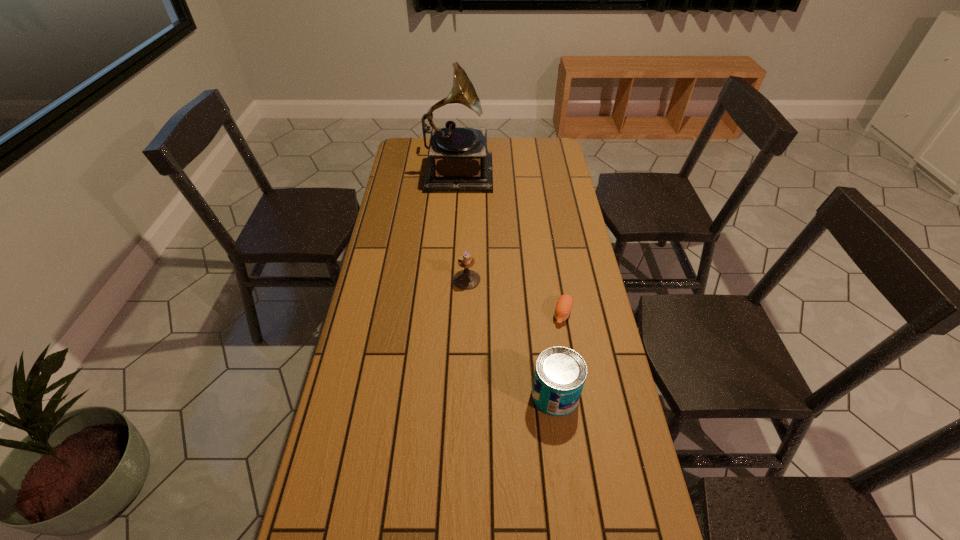
In order to click on free space between the sushi and the second farthest object in this screenshot , I will do `click(515, 296)`.

Where is `free space that is in between the tallest object and the third nearest object`? free space that is in between the tallest object and the third nearest object is located at coordinates (462, 225).

The width and height of the screenshot is (960, 540). I want to click on vacant area between the second farthest object and the shortest object, so click(x=515, y=296).

The height and width of the screenshot is (540, 960). Find the location of `empty space that is in between the can and the third nearest object`. empty space that is in between the can and the third nearest object is located at coordinates click(x=511, y=338).

The height and width of the screenshot is (540, 960). In order to click on empty space that is in between the can and the farthest object in this screenshot , I will do `click(506, 282)`.

Where is `object that stands as the third closest to the tallest object`? The height and width of the screenshot is (540, 960). object that stands as the third closest to the tallest object is located at coordinates (560, 373).

Select which object is the second closest to the third farthest object. Please provide its 2D coordinates. Your answer should be formatted as a tuple, i.e. [(x, y)], where the tuple contains the x and y coordinates of a point satisfying the conditions above.

[(466, 279)]

The image size is (960, 540). I want to click on blank area in the image that satisfies the following two spatial constraints: 1. on the back side of the nearest object; 2. on the horn of the record player, so click(526, 170).

The width and height of the screenshot is (960, 540). In order to click on vacant space that satisfies the following two spatial constraints: 1. on the horn of the record player; 2. on the back side of the candle holder in this screenshot , I will do `click(450, 280)`.

Where is `vacant position in the image that satisfies the following two spatial constraints: 1. on the horn of the third farthest object; 2. on the right side of the tallest object`? vacant position in the image that satisfies the following two spatial constraints: 1. on the horn of the third farthest object; 2. on the right side of the tallest object is located at coordinates (448, 313).